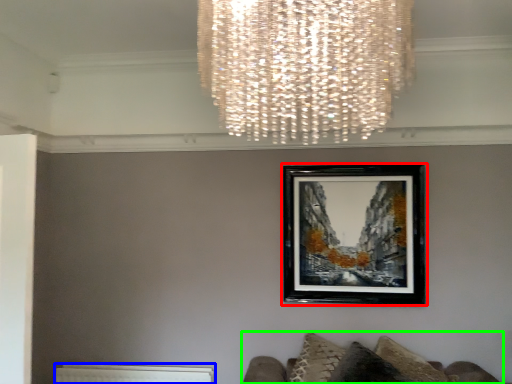
Question: Which object is positioned closest to picture frame (highlighted by a red box)? Select from radiator (highlighted by a blue box) and furniture (highlighted by a green box).

Choices:
 (A) radiator
 (B) furniture

Answer: (B)